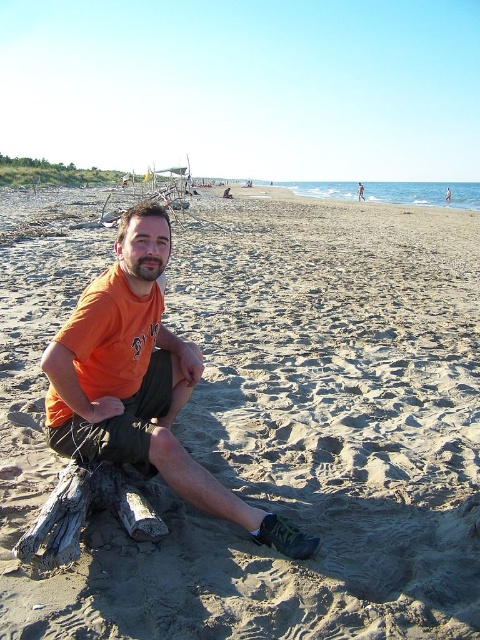
Question: Does sandytexturelog at left appear on the right side of gray weathered wood log at lower left?

Choices:
 (A) yes
 (B) no

Answer: (B)

Question: Which of the following is the closest to the observer?

Choices:
 (A) sandytexturelog at left
 (B) gray weathered wood log at lower left
 (C) orange cotton t-shirt at center

Answer: (A)

Question: Which point is farther from the camera taking this photo?

Choices:
 (A) (46, 534)
 (B) (148, 278)
 (C) (193, 237)

Answer: (C)

Question: Can you confirm if orange cotton t-shirt at center is positioned above gray weathered wood log at lower left?

Choices:
 (A) yes
 (B) no

Answer: (A)

Question: Which point is farther to the camera?

Choices:
 (A) (10, 340)
 (B) (113, 388)
 (C) (152, 524)

Answer: (A)

Question: Can you confirm if sandytexturelog at left is smaller than orange cotton t-shirt at center?

Choices:
 (A) no
 (B) yes

Answer: (A)